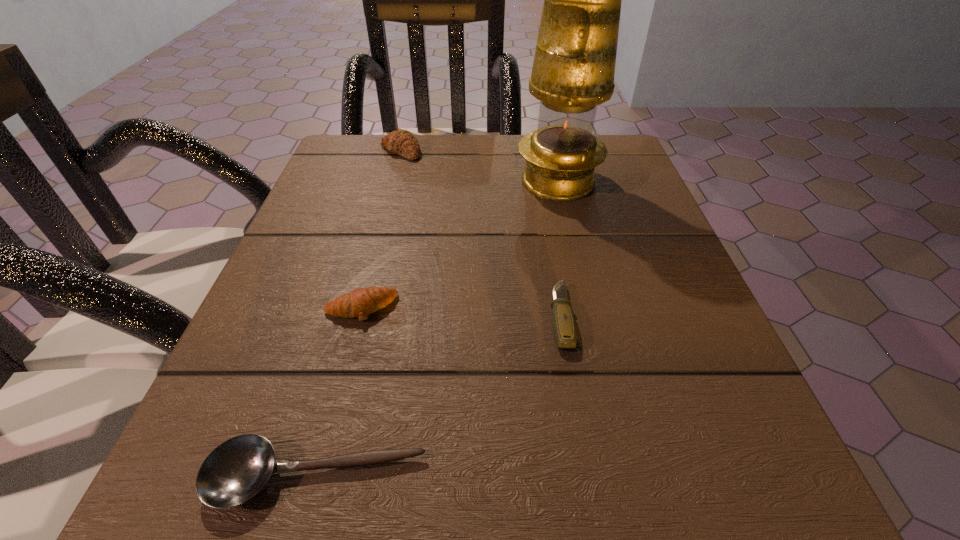
Where is `vacant space at the far edge of the desktop`? vacant space at the far edge of the desktop is located at coordinates (477, 174).

This screenshot has width=960, height=540. I want to click on free space at the near edge of the desktop, so click(x=632, y=524).

Locate an element on the screen. The image size is (960, 540). free space at the left edge is located at coordinates (277, 440).

Locate an element on the screen. The height and width of the screenshot is (540, 960). free space at the right edge of the desktop is located at coordinates (694, 429).

This screenshot has width=960, height=540. In the image, there is a desktop. Identify the location of free space at the far left corner. (383, 157).

Locate an element on the screen. The width and height of the screenshot is (960, 540). vacant space at the near right corner is located at coordinates (666, 462).

Identify the location of unoccupied position between the third tallest object and the taller crescent roll. [x=380, y=230].

Where is `vacant area between the pocketknife and the nearer crescent roll`? The image size is (960, 540). vacant area between the pocketknife and the nearer crescent roll is located at coordinates (461, 313).

At what (x,y) coordinates should I click in order to perform the action: click on vacant space that's between the pocketknife and the nearest object. Please return your answer as a coordinate pair (x, y). Looking at the image, I should click on (439, 397).

Locate an element on the screen. Image resolution: width=960 pixels, height=540 pixels. free point between the nearer crescent roll and the taller crescent roll is located at coordinates (380, 230).